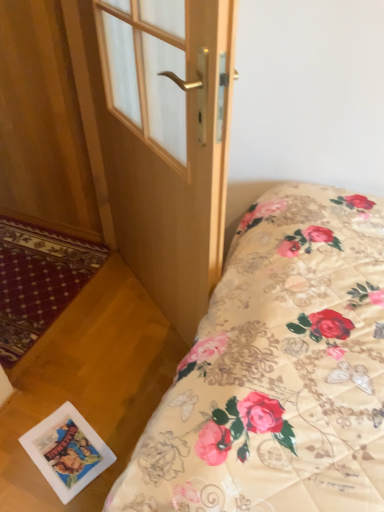
This screenshot has width=384, height=512. I want to click on vacant region to the left of wooden door at center, so click(104, 319).